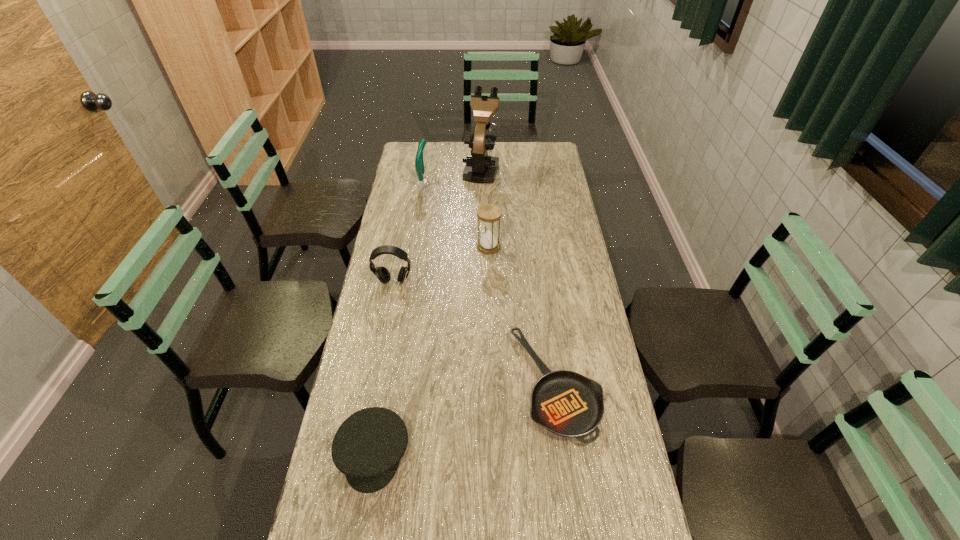
Where is `vacant position in the image that satisfies the following two spatial constraints: 1. at the jaws of the bottle opener; 2. on the left side of the frying pan`? The image size is (960, 540). vacant position in the image that satisfies the following two spatial constraints: 1. at the jaws of the bottle opener; 2. on the left side of the frying pan is located at coordinates (394, 385).

Find the location of `vacant space that satisfies the following two spatial constraints: 1. at the jaws of the fourth nearest object; 2. on the left side of the bottle opener`. vacant space that satisfies the following two spatial constraints: 1. at the jaws of the fourth nearest object; 2. on the left side of the bottle opener is located at coordinates (415, 247).

Identify the location of free space that satisfies the following two spatial constraints: 1. at the jaws of the second tallest object; 2. on the right side of the frying pan. (394, 385).